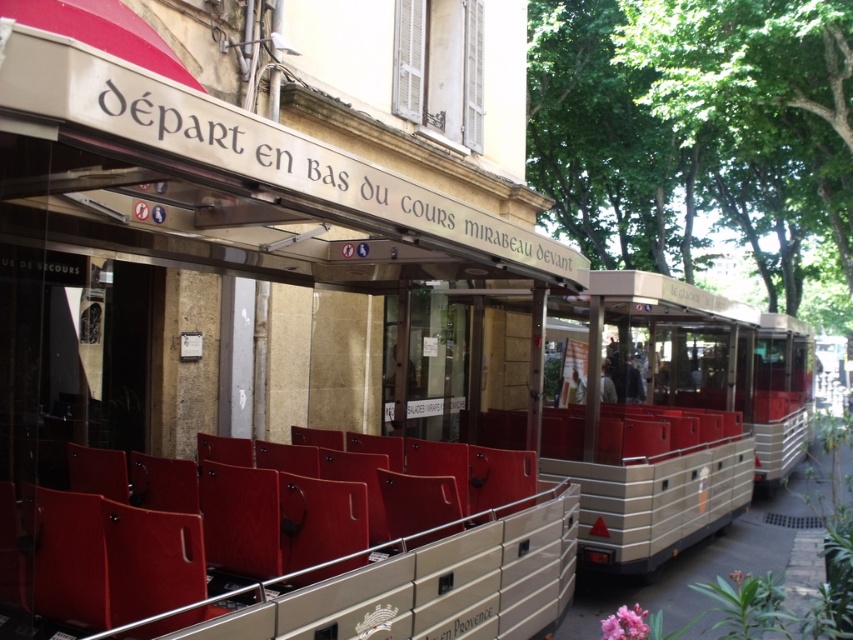
Which is above, matte red chair at center or metallic silver coach at center?

Positioned higher is metallic silver coach at center.

The width and height of the screenshot is (853, 640). I want to click on matte red chair at center, so [416, 500].

The height and width of the screenshot is (640, 853). I want to click on matte red chair at center, so click(416, 500).

Locate an element on the screen. matte red chair at center is located at coordinates (416, 500).